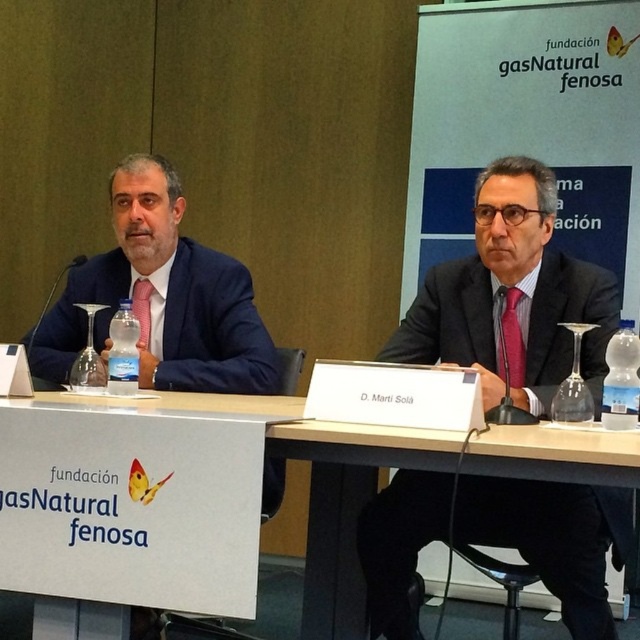
You are attending a formal meeting and need to place a document on the white plastic table at center. Given that the table is at coordinates point 0.794, 0.219, can you estimate its position relative to the room?

The white plastic table at center is located at point (140, 508), which means it is positioned towards the lower right quadrant of the room based on standard coordinate systems where the origin is at the bottom left corner.

You are organizing a small event and need to place a 1.5 meter long banner on the table. Given the white plastic table at center and the matte black suit at left, can the banner fit on the table?

The white plastic table at center has a smaller size compared to the matte black suit at left. Since the table is smaller, it might not accommodate a 1.5 meter banner. Check the table dimensions before placing the banner.